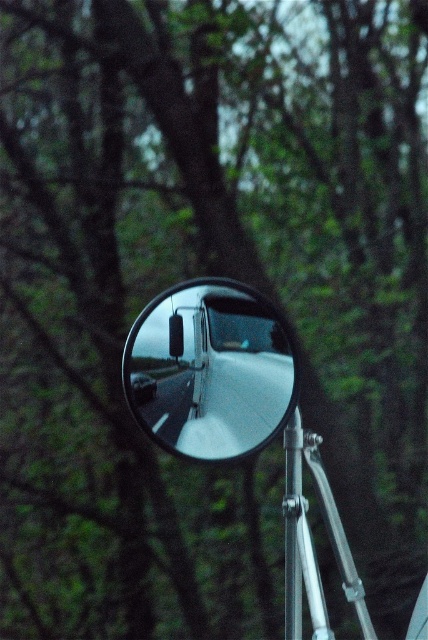
Question: Does clear glass mirror at center have a larger size compared to silver metallic pole at center?

Choices:
 (A) no
 (B) yes

Answer: (B)

Question: Which of the following is the farthest from the observer?

Choices:
 (A) silver metallic pole at center
 (B) clear glass mirror at center

Answer: (A)

Question: Considering the relative positions of clear glass mirror at center and silver metallic pole at center in the image provided, where is clear glass mirror at center located with respect to silver metallic pole at center?

Choices:
 (A) left
 (B) right

Answer: (A)

Question: Does clear glass mirror at center have a lesser width compared to silver metallic pole at center?

Choices:
 (A) no
 (B) yes

Answer: (A)